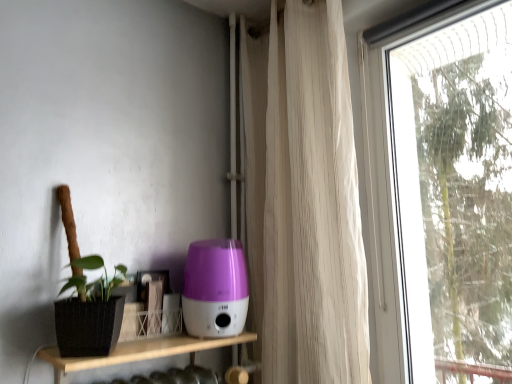
The width and height of the screenshot is (512, 384). What do you see at coordinates (442, 196) in the screenshot?
I see `transparent glass window at right` at bounding box center [442, 196].

Describe the element at coordinates (215, 289) in the screenshot. I see `purple plastic humidifier at center` at that location.

Where is `purple plastic humidifier at center`? Image resolution: width=512 pixels, height=384 pixels. purple plastic humidifier at center is located at coordinates (215, 289).

Where is `wooden shelf at lower left`? This screenshot has height=384, width=512. wooden shelf at lower left is located at coordinates (139, 352).

Could you tell me if wooden shelf at lower left is turned towards transparent glass window at right?

No, wooden shelf at lower left does not turn towards transparent glass window at right.

Is wooden shelf at lower left positioned far away from transparent glass window at right?

Yes, wooden shelf at lower left is far from transparent glass window at right.

Based on the photo, which object is more forward, wooden shelf at lower left or transparent glass window at right?

transparent glass window at right.

Looking at this image, which of these two, wooden shelf at lower left or transparent glass window at right, is thinner?

transparent glass window at right.

Considering the positions of objects white sheer curtain at right and wooden shelf at lower left in the image provided, who is more to the left, white sheer curtain at right or wooden shelf at lower left?

wooden shelf at lower left is more to the left.

Is wooden shelf at lower left located within white sheer curtain at right?

No.

The width and height of the screenshot is (512, 384). I want to click on shelf below the white sheer curtain at right (from the image's perspective), so click(x=139, y=352).

Considering the positions of point (361, 265) and point (172, 355), is point (361, 265) closer or farther from the camera than point (172, 355)?

Point (361, 265) is farther from the camera than point (172, 355).

Is purple plastic humidifier at center behind white sheer curtain at right?

Yes.

Considering the relative sizes of purple plastic humidifier at center and white sheer curtain at right in the image provided, is purple plastic humidifier at center taller than white sheer curtain at right?

No.

Is purple plastic humidifier at center positioned with its back to white sheer curtain at right?

No.

Considering the points (228, 268) and (309, 138), which point is in front, point (228, 268) or point (309, 138)?

Positioned in front is point (228, 268).

Is transparent glass window at right at the back of purple plastic humidifier at center?

No, purple plastic humidifier at center's orientation is not away from transparent glass window at right.

From a real-world perspective, relative to transparent glass window at right, is purple plastic humidifier at center vertically above or below?

In terms of real-world spatial position, purple plastic humidifier at center is below transparent glass window at right.

Are purple plastic humidifier at center and transparent glass window at right making contact?

purple plastic humidifier at center and transparent glass window at right are clearly separated.

How many degrees apart are the facing directions of purple plastic humidifier at center and transparent glass window at right?

There is a 90.2-degree angle between the facing directions of purple plastic humidifier at center and transparent glass window at right.

Could you tell me if white sheer curtain at right is facing purple plastic humidifier at center?

Yes, white sheer curtain at right is oriented towards purple plastic humidifier at center.

Considering the relative positions of white sheer curtain at right and purple plastic humidifier at center in the image provided, is white sheer curtain at right to the left or to the right of purple plastic humidifier at center?

white sheer curtain at right is positioned on purple plastic humidifier at center's right side.

Is white sheer curtain at right positioned beyond the bounds of purple plastic humidifier at center?

Indeed, white sheer curtain at right is completely outside purple plastic humidifier at center.

How far apart are white sheer curtain at right and purple plastic humidifier at center?

white sheer curtain at right is 14.29 inches from purple plastic humidifier at center.

Is purple plastic humidifier at center not near wooden shelf at lower left?

Actually, purple plastic humidifier at center and wooden shelf at lower left are a little close together.

Considering the points (240, 285) and (197, 347), which point is behind, point (240, 285) or point (197, 347)?

The point (240, 285) is more distant.

Find the location of a particular element. The image size is (512, 384). shelf below the purple plastic humidifier at center (from the image's perspective) is located at coordinates (139, 352).

Is purple plastic humidifier at center to the right of wooden shelf at lower left from the viewer's perspective?

Correct, you'll find purple plastic humidifier at center to the right of wooden shelf at lower left.

From their relative heights in the image, would you say white sheer curtain at right is taller or shorter than transparent glass window at right?

In the image, white sheer curtain at right appears to be taller than transparent glass window at right.

Who is smaller, white sheer curtain at right or transparent glass window at right?

transparent glass window at right.

Does white sheer curtain at right turn towards transparent glass window at right?

No, white sheer curtain at right is not aimed at transparent glass window at right.

From the image's perspective, would you say white sheer curtain at right is shown under transparent glass window at right?

No, from the image's perspective, white sheer curtain at right is not beneath transparent glass window at right.

This screenshot has height=384, width=512. In order to click on window above the wooden shelf at lower left (from a real-world perspective) in this screenshot , I will do `click(442, 196)`.

The width and height of the screenshot is (512, 384). In order to click on curtain on the right of wooden shelf at lower left in this screenshot , I will do `click(303, 200)`.

Based on their spatial positions, is wooden shelf at lower left or white sheer curtain at right further from transparent glass window at right?

Based on the image, wooden shelf at lower left appears to be further to transparent glass window at right.

From the image, which object appears to be farther from transparent glass window at right, wooden shelf at lower left or purple plastic humidifier at center?

Among the two, wooden shelf at lower left is located further to transparent glass window at right.

Based on their spatial positions, is wooden shelf at lower left or transparent glass window at right further from purple plastic humidifier at center?

transparent glass window at right lies further to purple plastic humidifier at center than the other object.

When comparing their distances from white sheer curtain at right, does wooden shelf at lower left or purple plastic humidifier at center seem closer?

Based on the image, purple plastic humidifier at center appears to be nearer to white sheer curtain at right.

Looking at the image, which one is located closer to wooden shelf at lower left, white sheer curtain at right or purple plastic humidifier at center?

The object closer to wooden shelf at lower left is purple plastic humidifier at center.

Estimate the real-world distances between objects in this image. Which object is closer to wooden shelf at lower left, purple plastic humidifier at center or white sheer curtain at right?

purple plastic humidifier at center.

When comparing their distances from wooden shelf at lower left, does white sheer curtain at right or transparent glass window at right seem further?

transparent glass window at right is positioned further to the anchor wooden shelf at lower left.

Estimate the real-world distances between objects in this image. Which object is further from white sheer curtain at right, purple plastic humidifier at center or transparent glass window at right?

transparent glass window at right is positioned further to the anchor white sheer curtain at right.

This screenshot has height=384, width=512. Find the location of `appliance between white sheer curtain at right and wooden shelf at lower left from top to bottom`. appliance between white sheer curtain at right and wooden shelf at lower left from top to bottom is located at coordinates (215, 289).

In order to click on curtain between wooden shelf at lower left and transparent glass window at right in the horizontal direction in this screenshot , I will do `click(303, 200)`.

Where is `appliance situated between wooden shelf at lower left and transparent glass window at right from left to right`? appliance situated between wooden shelf at lower left and transparent glass window at right from left to right is located at coordinates (215, 289).

The image size is (512, 384). In order to click on curtain situated between purple plastic humidifier at center and transparent glass window at right from left to right in this screenshot , I will do `click(303, 200)`.